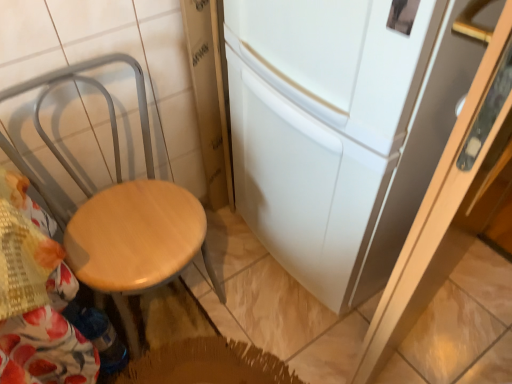
Question: Is white matte refrigerator at center taller or shorter than wooden seat at left?

Choices:
 (A) short
 (B) tall

Answer: (B)

Question: Is point (232, 165) positioned closer to the camera than point (139, 279)?

Choices:
 (A) closer
 (B) farther

Answer: (B)

Question: Visually, is white matte refrigerator at center positioned to the left or to the right of wooden seat at left?

Choices:
 (A) right
 (B) left

Answer: (A)

Question: Looking at their shapes, would you say wooden seat at left is wider or thinner than white matte refrigerator at center?

Choices:
 (A) thin
 (B) wide

Answer: (A)

Question: Is wooden seat at left inside the boundaries of white matte refrigerator at center, or outside?

Choices:
 (A) outside
 (B) inside

Answer: (A)

Question: Based on their sizes in the image, would you say wooden seat at left is bigger or smaller than white matte refrigerator at center?

Choices:
 (A) big
 (B) small

Answer: (B)

Question: Considering the positions of point (112, 54) and point (450, 52), is point (112, 54) closer or farther from the camera than point (450, 52)?

Choices:
 (A) farther
 (B) closer

Answer: (A)